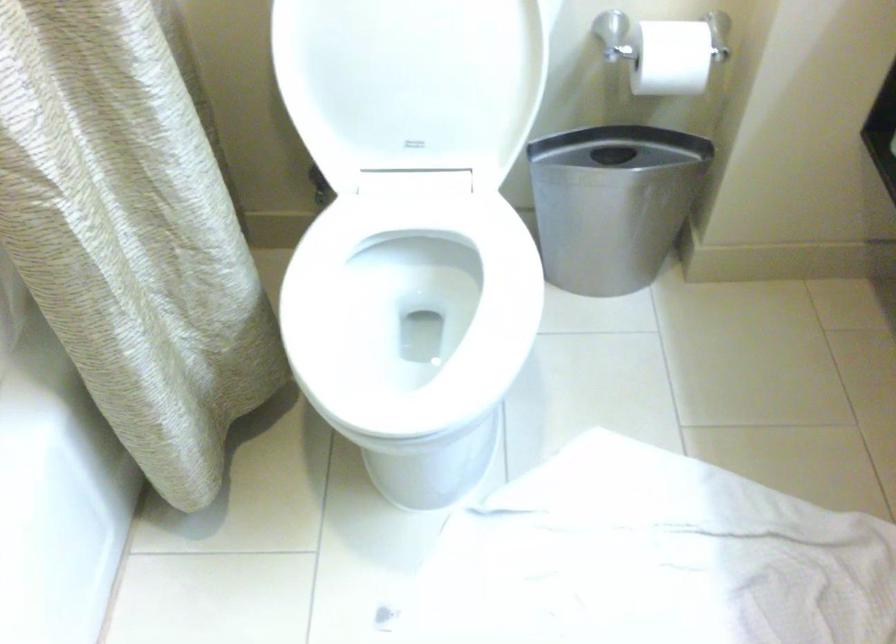
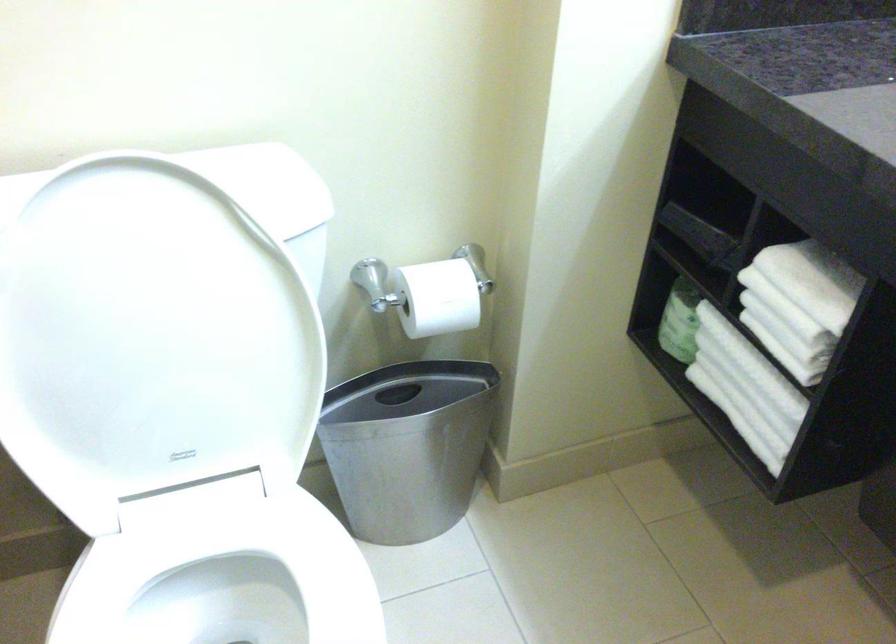
Find the pixel in the second image that matches point (607, 198) in the first image.

(408, 446)